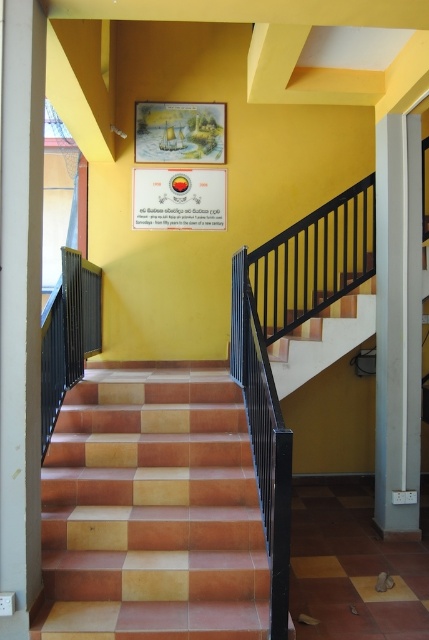
You are standing at the bottom of the stairs and want to reach the top. The terracotta tile stairs at center are 3.05 meters away from you. If your stride length is 0.75 meters, how many steps will you need to take to reach the top?

The terracotta tile stairs at center is 3.05 meters away from the viewer. With a stride length of 0.75 meters, you would need approximately 4 steps to cover the distance, as 3.05 divided by 0.75 equals roughly 4.07, meaning you would need to take 4 full steps to reach the top.

In the scene shown: You are an interior designer planning to place a new decorative item on the staircase wall. The item you have in mind is 10 cm thick. You see the white smooth pillar at right and the matte paper sign at upper center. Which object can the new item be placed next to without exceeding its thickness?

The white smooth pillar at right is thinner than the matte paper sign at upper center, so the new decorative item with 10 cm thickness can be placed next to the white smooth pillar at right as it is thinner and may have more space available.

You are a delivery person carrying a package that is 1.8 meters long. You need to walk up the terracotta tile stairs at center. Can you carry the package upright while ascending the stairs?

The distance between the terracotta tile stairs at center and the camera is 3.05 meters. Since the package is 1.8 meters long, which is shorter than the available space, you can carry the package upright while ascending the stairs.